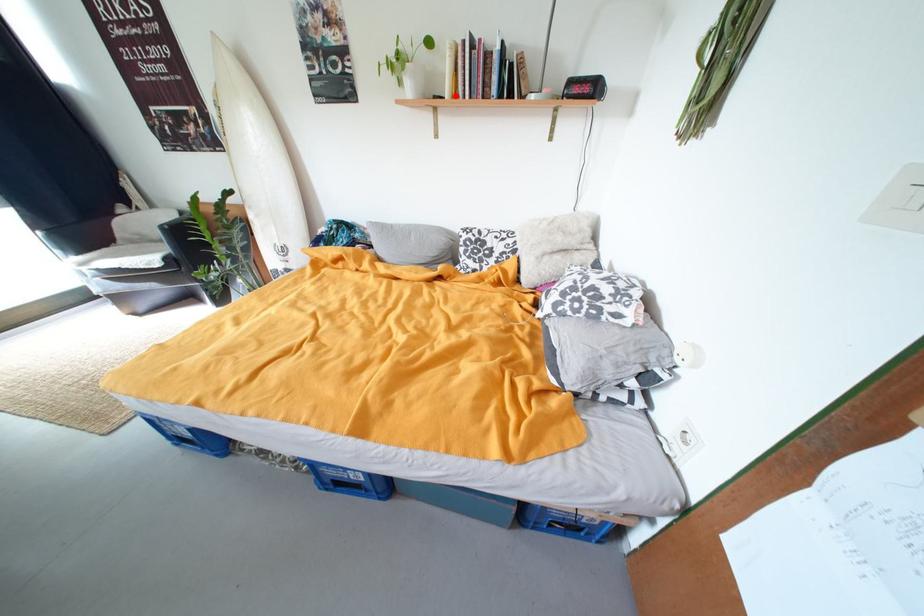
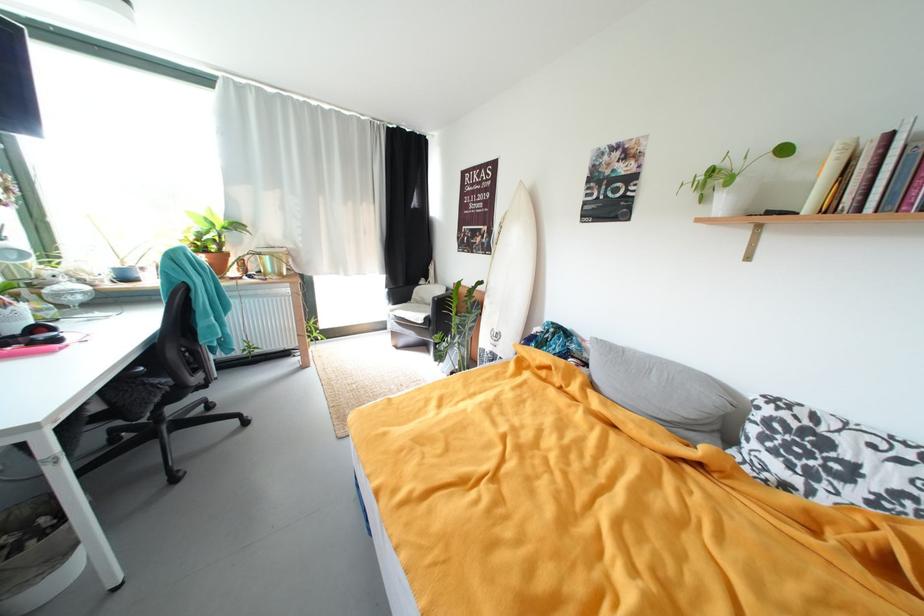
Where in the second image is the point corresponding to the highlighted location from the first image?

(817, 209)